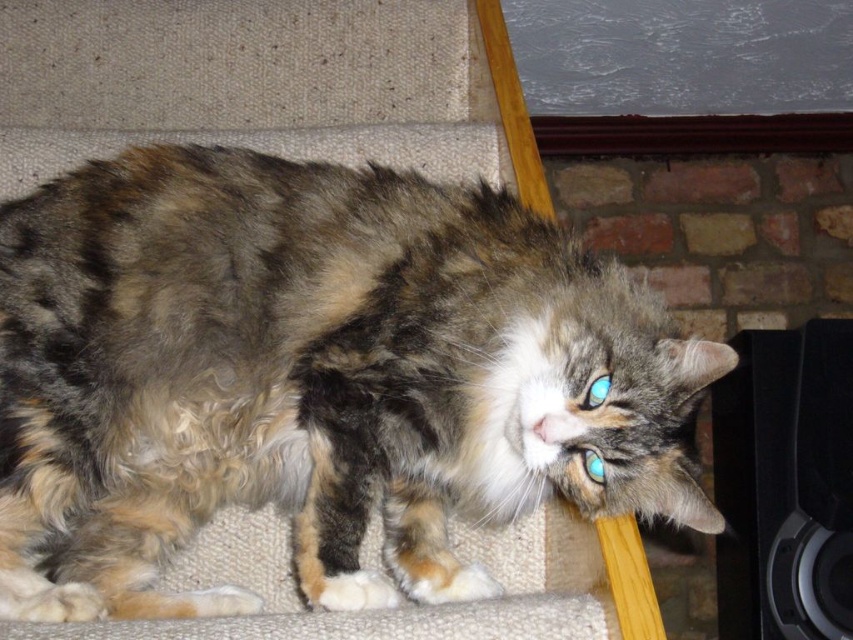
You are trying to decide if the fuzzy fur cat at center can reach the top of the black matte speaker at right. Based on their heights, can the cat reach the top?

The fuzzy fur cat at center is shorter than the black matte speaker at right, so it cannot reach the top of the black matte speaker at right.

You are trying to place a new decorative item on the wooden beam behind the fuzzy fur cat at center and the black matte speaker at right. Which object should you place the item closer to if you want it to be near the right side of the scene?

You should place the decorative item closer to the black matte speaker at right because the fuzzy fur cat at center is on the left side of the black matte speaker at right, making the speaker closer to the right side of the scene.